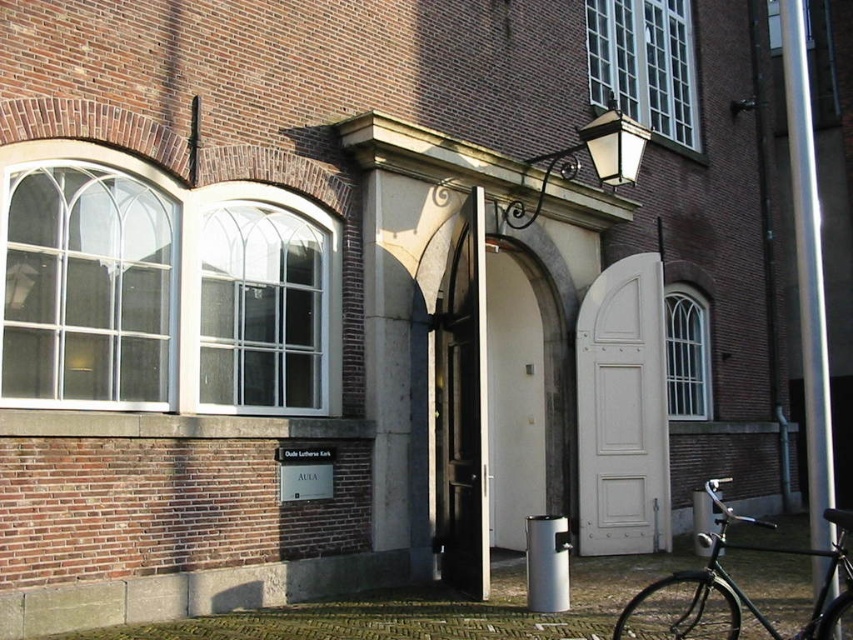
Question: Can you confirm if clear glass window at upper right is positioned below white glass window at upper right?

Choices:
 (A) no
 (B) yes

Answer: (A)

Question: Does clear glass window at upper left appear on the right side of white glass window at upper right?

Choices:
 (A) yes
 (B) no

Answer: (B)

Question: Which of these objects is positioned farthest from the clear glass window at upper left?

Choices:
 (A) white glass window at upper right
 (B) white wooden door at center

Answer: (A)

Question: Is clear glass window at upper left wider than clear glass window at upper right?

Choices:
 (A) yes
 (B) no

Answer: (B)

Question: Which object appears farthest from the camera in this image?

Choices:
 (A) clear glass window at center
 (B) white glass window at upper right

Answer: (B)

Question: Which point is closer to the camera?

Choices:
 (A) (706, 573)
 (B) (312, 330)
 (C) (70, 220)
 (D) (670, 396)

Answer: (A)